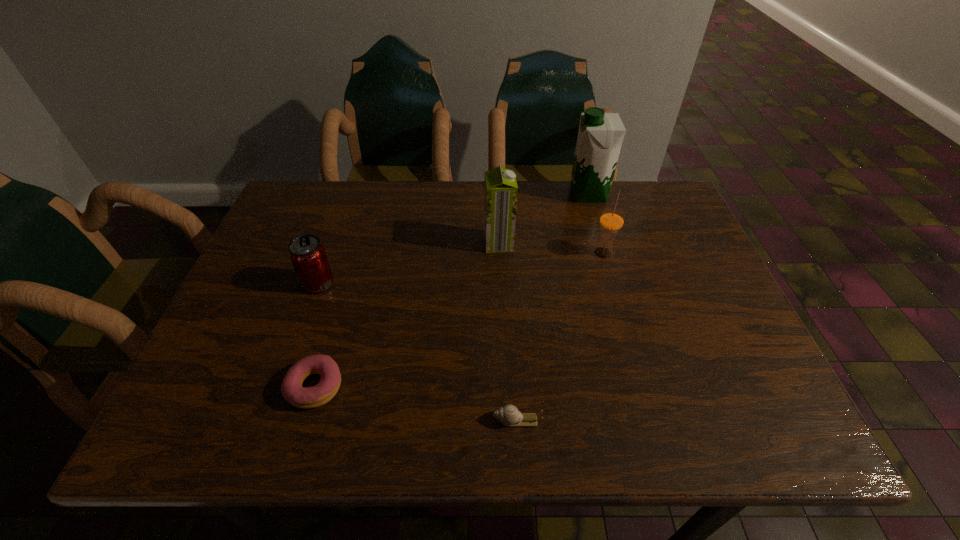
At what (x,y) coordinates should I click in order to perform the action: click on free space located on the front-facing side of the right soya milk. Please return your answer as a coordinate pair (x, y). Looking at the image, I should click on (475, 194).

Where is `vacant space located 0.380m on the front-facing side of the right soya milk`? vacant space located 0.380m on the front-facing side of the right soya milk is located at coordinates (443, 194).

This screenshot has width=960, height=540. What are the coordinates of `free region located on the left of the left soya milk` in the screenshot? It's located at (435, 244).

At what (x,y) coordinates should I click in order to perform the action: click on free region located 0.270m on the back of the straw. Please return your answer as a coordinate pair (x, y). Looking at the image, I should click on (584, 185).

At what (x,y) coordinates should I click in order to perform the action: click on vacant space located on the back of the fourth tallest object. Please return your answer as a coordinate pair (x, y). The height and width of the screenshot is (540, 960). Looking at the image, I should click on (335, 235).

The width and height of the screenshot is (960, 540). I want to click on blank space located 0.260m on the back of the doughnut, so click(348, 273).

Identify the location of vacant region located 0.290m on the shell of the escargot. This screenshot has width=960, height=540. (337, 420).

You are a GUI agent. You are given a task and a screenshot of the screen. Output one action in this format:
    pyautogui.click(x=<x>, y=<y>)
    Task: Click on the vacant region located on the shell of the escargot
    
    Given the screenshot: What is the action you would take?
    pyautogui.click(x=423, y=420)

At what (x,y) coordinates should I click in order to perform the action: click on free space located 0.130m on the shell of the escargot. Please return your answer as a coordinate pair (x, y). Looking at the image, I should click on (423, 420).

Image resolution: width=960 pixels, height=540 pixels. In order to click on object that is at the far edge in this screenshot , I will do `click(600, 136)`.